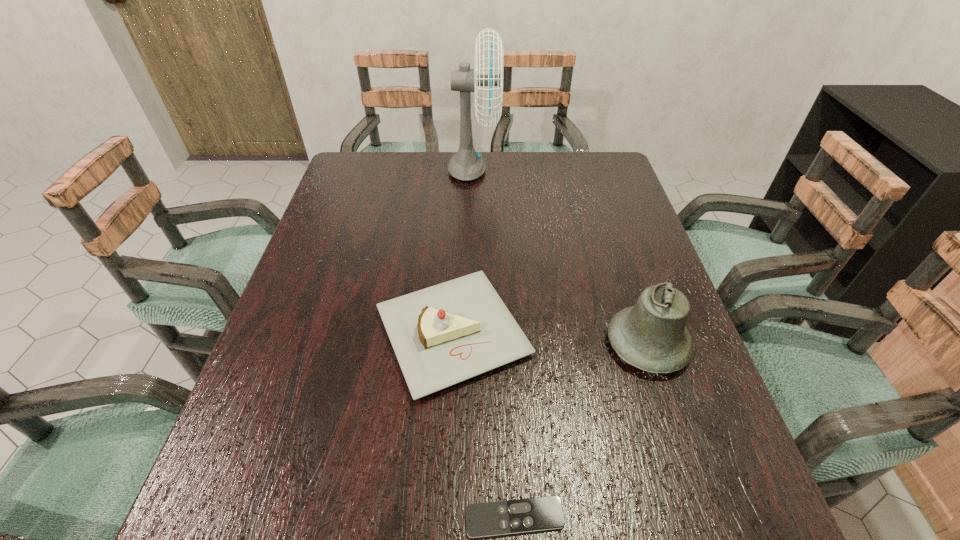
Where is `the farthest object`? The image size is (960, 540). the farthest object is located at coordinates (466, 165).

You are a GUI agent. You are given a task and a screenshot of the screen. Output one action in this format:
    pyautogui.click(x=<x>, y=<y>)
    Task: Click on the fan
    
    Given the screenshot: What is the action you would take?
    pyautogui.click(x=466, y=165)

The width and height of the screenshot is (960, 540). Identify the location of bell. (651, 336).

The width and height of the screenshot is (960, 540). In order to click on the rightmost object in this screenshot , I will do `click(651, 336)`.

Where is `cake`? The height and width of the screenshot is (540, 960). cake is located at coordinates [x=442, y=335].

Identify the location of the nearest object. (541, 513).

Find the location of a particular element. The width and height of the screenshot is (960, 540). remote control is located at coordinates (541, 513).

This screenshot has height=540, width=960. What are the coordinates of `vacant space located 0.400m on the front-facing side of the farthest object` in the screenshot? It's located at (620, 171).

Find the location of a particular element. vacant point located 0.180m on the front of the rightmost object is located at coordinates (688, 468).

This screenshot has width=960, height=540. I want to click on vacant space located on the back of the cake, so 457,258.